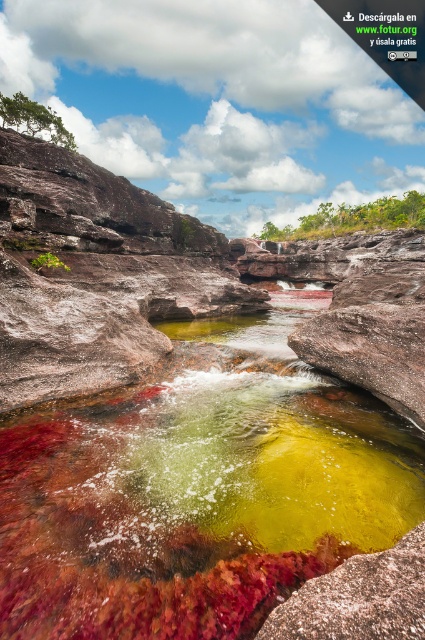
You are standing at the point with coordinates (x=359, y=598) in this waterway scene. What object is exactly at your current position?

The smooth rock at center is located at point (x=359, y=598).

From the picture: You are standing at the edge of the waterway and want to step into the translucent rock pool at center. However, there is green algae at upper center above it. Can you safely step into the pool without slipping on the algae?

The translucent rock pool at center is closer to the viewer than the green algae at upper center, meaning the algae is positioned above the pool. Since the algae is above the pool, stepping into the pool itself would not involve slipping on the algae located above it.

You are a geologist examining the waterway. You need to determine which object has a greater width between the smooth rock at center and the green algae at upper center. Based on the scene, which one is wider?

The green algae at upper center is wider than the smooth rock at center because the smooth rock at center is thinner than green algae at upper center.